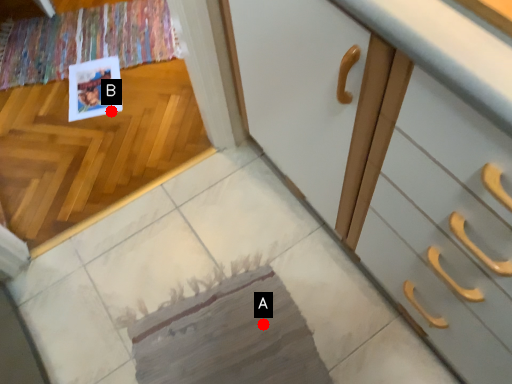
Question: Two points are circled on the image, labeled by A and B beside each circle. Which point is closer to the camera?

Choices:
 (A) A is closer
 (B) B is closer

Answer: (A)